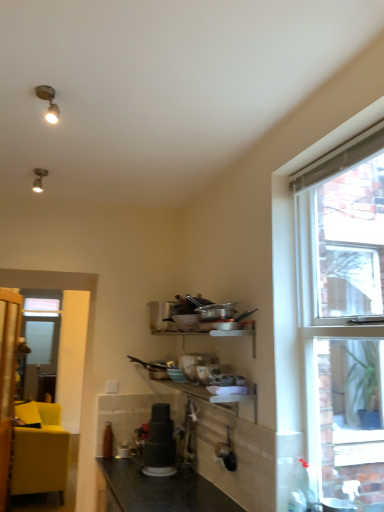
This screenshot has width=384, height=512. What do you see at coordinates (41, 455) in the screenshot?
I see `matte yellow couch at left` at bounding box center [41, 455].

Describe the element at coordinates (159, 443) in the screenshot. I see `matte black blender at center` at that location.

The width and height of the screenshot is (384, 512). What are the coordinates of `matte black blender at center` in the screenshot? It's located at point(159,443).

You are a GUI agent. You are given a task and a screenshot of the screen. Output one action in this format:
    pyautogui.click(x=<x>, y=<y>)
    Task: Click on the matte yellow couch at left
    This screenshot has height=512, width=384.
    Given the screenshot: What is the action you would take?
    pyautogui.click(x=41, y=455)

From the image's perspective, which is above, clear glass window at upper right or matte black blender at center?

clear glass window at upper right.

Is point (351, 231) farther from camera compared to point (168, 433)?

That is True.

Which object is thinner, clear glass window at upper right or matte black blender at center?

matte black blender at center is thinner.

Based on the photo, is clear glass window at upper right oriented away from matte black blender at center?

No.

Is black granite countertop at lower center far from matte black blender at center?

That's not correct — black granite countertop at lower center is a little close to matte black blender at center.

This screenshot has width=384, height=512. Identify the location of countertop directly beneath the matte black blender at center (from a real-world perspective). (163, 489).

In the image, is black granite countertop at lower center positioned in front of or behind matte black blender at center?

Clearly, black granite countertop at lower center is in front of matte black blender at center.

From the image's perspective, relative to matte black blender at center, is black granite countertop at lower center above or below?

From the image's perspective, black granite countertop at lower center appears below matte black blender at center.

From the picture: Is black granite countertop at lower center facing towards matte yellow couch at left?

No, black granite countertop at lower center is not oriented towards matte yellow couch at left.

Which of these two, black granite countertop at lower center or matte yellow couch at left, is wider?

matte yellow couch at left is wider.

This screenshot has width=384, height=512. I want to click on studio couch located behind the black granite countertop at lower center, so click(x=41, y=455).

From a real-world perspective, is matte black blender at center on matte yellow couch at left?

Yes.

Considering the positions of objects matte black blender at center and matte yellow couch at left in the image provided, who is in front, matte black blender at center or matte yellow couch at left?

matte black blender at center.

Would you say matte black blender at center is inside or outside matte yellow couch at left?

matte black blender at center is not inside matte yellow couch at left, it's outside.

What's the angular difference between matte black blender at center and matte yellow couch at left's facing directions?

The angular difference between matte black blender at center and matte yellow couch at left is 176 degrees.

Based on the photo, are matte yellow couch at left and clear glass window at upper right beside each other?

matte yellow couch at left is not next to clear glass window at upper right, and they're not touching.

From the image's perspective, is matte yellow couch at left positioned above or below clear glass window at upper right?

From the image's perspective, matte yellow couch at left appears below clear glass window at upper right.

Does matte yellow couch at left have a greater height compared to clear glass window at upper right?

In fact, matte yellow couch at left may be shorter than clear glass window at upper right.

Is matte yellow couch at left not inside clear glass window at upper right?

matte yellow couch at left is positioned outside clear glass window at upper right.

Is point (168, 463) closer to viewer compared to point (321, 237)?

No, (168, 463) is further to viewer.

Can you confirm if matte black blender at center is shorter than clear glass window at upper right?

Indeed, matte black blender at center has a lesser height compared to clear glass window at upper right.

Is matte black blender at center aimed at clear glass window at upper right?

No, matte black blender at center does not turn towards clear glass window at upper right.

Between clear glass window at upper right and black granite countertop at lower center, which one appears on the right side from the viewer's perspective?

clear glass window at upper right.

Considering the sizes of clear glass window at upper right and black granite countertop at lower center in the image, is clear glass window at upper right bigger or smaller than black granite countertop at lower center?

Clearly, clear glass window at upper right is larger in size than black granite countertop at lower center.

Looking at their sizes, would you say clear glass window at upper right is wider or thinner than black granite countertop at lower center?

In the image, clear glass window at upper right appears to be more narrow than black granite countertop at lower center.

From a real-world perspective, does clear glass window at upper right sit lower than black granite countertop at lower center?

No, from a real-world perspective, clear glass window at upper right is not beneath black granite countertop at lower center.

What are the coordinates of `window on the right of matte black blender at center` in the screenshot? It's located at (343, 315).

At what (x,y) coordinates should I click in order to perform the action: click on appliance that appears above the black granite countertop at lower center (from the image's perspective). Please return your answer as a coordinate pair (x, y). Looking at the image, I should click on (159, 443).

Estimate the real-world distances between objects in this image. Which object is closer to clear glass window at upper right, matte yellow couch at left or black granite countertop at lower center?

black granite countertop at lower center lies closer to clear glass window at upper right than the other object.

Based on their spatial positions, is black granite countertop at lower center or matte black blender at center closer to clear glass window at upper right?

matte black blender at center is closer to clear glass window at upper right.

Considering their positions, is matte black blender at center positioned closer to black granite countertop at lower center than clear glass window at upper right?

Among the two, matte black blender at center is located nearer to black granite countertop at lower center.

From the image, which object appears to be nearer to black granite countertop at lower center, matte yellow couch at left or clear glass window at upper right?

matte yellow couch at left is closer to black granite countertop at lower center.

Which object lies nearer to the anchor point matte yellow couch at left, matte black blender at center or clear glass window at upper right?

matte black blender at center lies closer to matte yellow couch at left than the other object.

When comparing their distances from matte black blender at center, does clear glass window at upper right or matte yellow couch at left seem closer?

matte yellow couch at left.

Looking at this image, estimate the real-world distances between objects in this image. Which object is closer to matte black blender at center, matte yellow couch at left or clear glass window at upper right?

matte yellow couch at left is closer to matte black blender at center.

When comparing their distances from clear glass window at upper right, does black granite countertop at lower center or matte yellow couch at left seem closer?

The object closer to clear glass window at upper right is black granite countertop at lower center.

This screenshot has height=512, width=384. What are the coordinates of `countertop between clear glass window at upper right and matte black blender at center from front to back` in the screenshot? It's located at (163, 489).

At what (x,y) coordinates should I click in order to perform the action: click on appliance between matte yellow couch at left and black granite countertop at lower center from left to right. Please return your answer as a coordinate pair (x, y). Image resolution: width=384 pixels, height=512 pixels. Looking at the image, I should click on (159, 443).

Where is `countertop situated between matte yellow couch at left and clear glass window at upper right from left to right`? The width and height of the screenshot is (384, 512). countertop situated between matte yellow couch at left and clear glass window at upper right from left to right is located at coordinates (163, 489).

Identify the location of appliance between matte yellow couch at left and clear glass window at upper right in the horizontal direction. (159, 443).